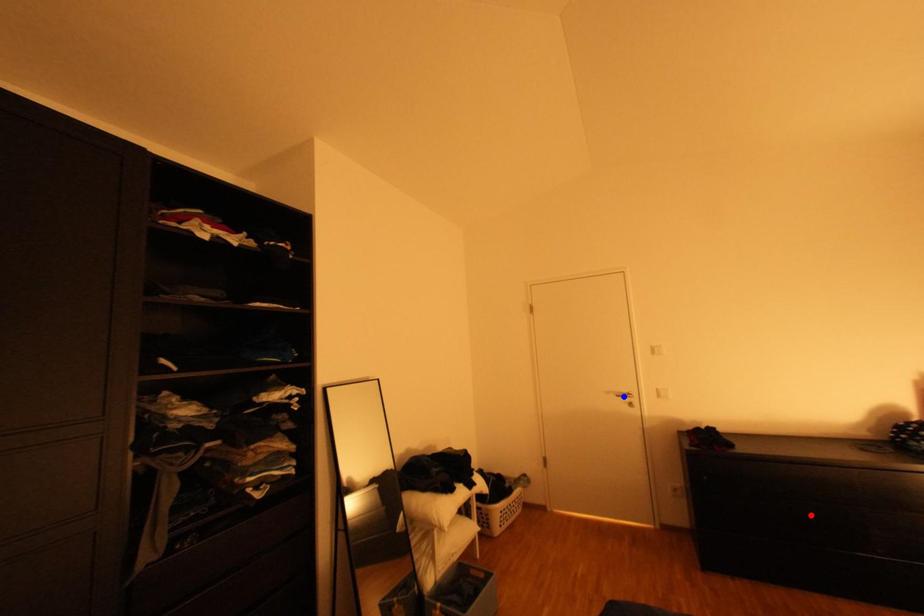
Question: In the image, two points are highlighted. Which point is nearer to the camera? Reply with the corresponding letter.

Choices:
 (A) blue point
 (B) red point

Answer: (B)